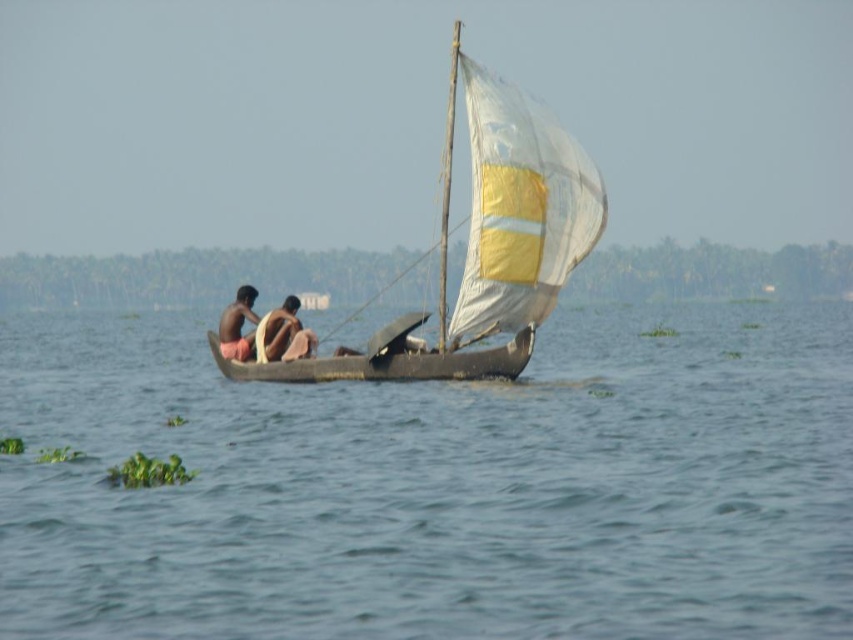
You are a photographer standing on the dock. You want to take a photo of the white fabric sailboat at center and the brown skin person at left. However, the sailboat is blocking the view of the person. Can you move the sailboat to the right to get a clear shot of the person?

The white fabric sailboat at center is positioned over brown skin person at left, so moving the sailboat to the right would allow the photographer to see the brown skin person at left clearly.

Looking at this image, you are a drone operator trying to capture a photo of the dark brown wood canoe at center. What are the coordinates you should aim for?

The coordinates for the dark brown wood canoe at center are at point (386, 364).

You are standing on the dock and see the dark brown wood canoe at center and the brown skin person at center in the water. From your perspective on the dock, which object is positioned to the right?

The dark brown wood canoe at center is positioned to the right of the brown skin person at center.